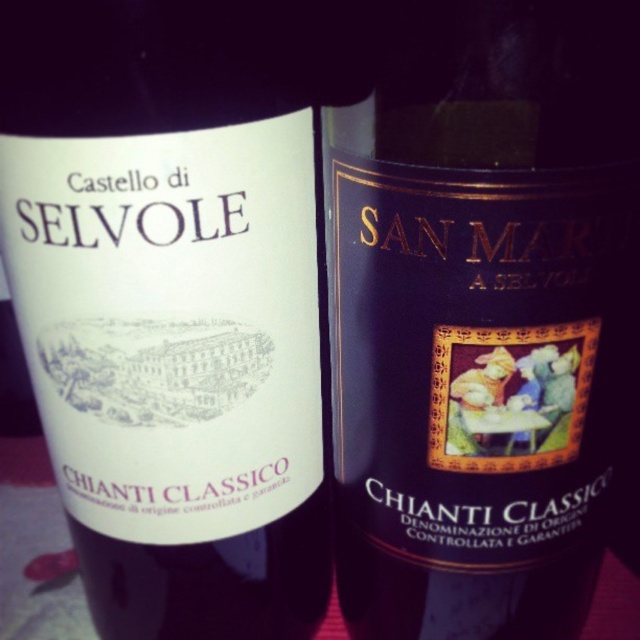
Question: Which of the following is the closest to the observer?

Choices:
 (A) dark purple matte bottle at center
 (B) white matte wine bottle at center

Answer: (A)

Question: Can you confirm if white matte wine bottle at center is positioned to the left of dark purple matte bottle at center?

Choices:
 (A) yes
 (B) no

Answer: (A)

Question: Can you confirm if white matte wine bottle at center is positioned above dark purple matte bottle at center?

Choices:
 (A) yes
 (B) no

Answer: (A)

Question: Can you confirm if white matte wine bottle at center is thinner than dark purple matte bottle at center?

Choices:
 (A) yes
 (B) no

Answer: (A)

Question: Among these objects, which one is nearest to the camera?

Choices:
 (A) white matte wine bottle at center
 (B) dark purple matte bottle at center

Answer: (B)